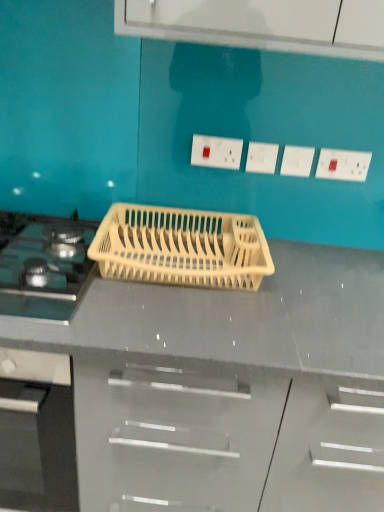
What do you see at coordinates (181, 247) in the screenshot? I see `beige plastic dish rack at center` at bounding box center [181, 247].

Where is `white plastic electric outlet at upper right, which appears as the 1th electric outlet when viewed from the right`? The width and height of the screenshot is (384, 512). white plastic electric outlet at upper right, which appears as the 1th electric outlet when viewed from the right is located at coordinates (343, 165).

This screenshot has width=384, height=512. Describe the element at coordinates (216, 152) in the screenshot. I see `white plastic electric outlet at center, the first electric outlet from the left` at that location.

In order to face white plastic electric outlet at upper center, which is the second electric outlet from left to right, should I rotate leftwards or rightwards?

Turn right by 9.595 degrees to look at white plastic electric outlet at upper center, which is the second electric outlet from left to right.

Identify the location of beige plastic dish rack at center. The image size is (384, 512). (181, 247).

Could you tell me if matte black gas stove at left is facing white plastic electric outlet at upper right, positioned as the 4th electric outlet in left-to-right order?

No, matte black gas stove at left is not facing towards white plastic electric outlet at upper right, positioned as the 4th electric outlet in left-to-right order.

Does matte black gas stove at left have a lesser height compared to white plastic electric outlet at upper right, which appears as the 1th electric outlet when viewed from the right?

Indeed, matte black gas stove at left has a lesser height compared to white plastic electric outlet at upper right, which appears as the 1th electric outlet when viewed from the right.

From a real-world perspective, is matte black gas stove at left under white plastic electric outlet at upper right, positioned as the 4th electric outlet in left-to-right order?

Yes, from a real-world perspective, matte black gas stove at left is below white plastic electric outlet at upper right, positioned as the 4th electric outlet in left-to-right order.

I want to click on gas stove below the white plastic electric outlet at upper right, which appears as the 1th electric outlet when viewed from the right (from the image's perspective), so click(46, 268).

Could you tell me if white plastic electric outlet at upper center, the third electric outlet viewed from the right, is turned towards white plastic electric outlet at upper center, the third electric outlet from the left?

No, white plastic electric outlet at upper center, the third electric outlet viewed from the right, does not turn towards white plastic electric outlet at upper center, the third electric outlet from the left.

Between point (272, 148) and point (303, 153), which one is positioned behind?

The point (303, 153) is more distant.

Which object is wider, white plastic electric outlet at upper center, the third electric outlet viewed from the right, or white plastic electric outlet at upper center, the second electric outlet from the right?

With larger width is white plastic electric outlet at upper center, the third electric outlet viewed from the right.

In terms of size, does white plastic electric outlet at upper center, the third electric outlet viewed from the right, appear bigger or smaller than white plastic electric outlet at upper center, the third electric outlet from the left?

In the image, white plastic electric outlet at upper center, the third electric outlet viewed from the right, appears to be larger than white plastic electric outlet at upper center, the third electric outlet from the left.

In terms of size, does white plastic electric outlet at upper right, which appears as the 1th electric outlet when viewed from the right, appear bigger or smaller than matte black gas stove at left?

white plastic electric outlet at upper right, which appears as the 1th electric outlet when viewed from the right, is smaller than matte black gas stove at left.

From a real-world perspective, who is located lower, white plastic electric outlet at upper right, positioned as the 4th electric outlet in left-to-right order, or matte black gas stove at left?

matte black gas stove at left, from a real-world perspective.

Between white plastic electric outlet at upper right, which appears as the 1th electric outlet when viewed from the right, and matte black gas stove at left, which one appears on the left side from the viewer's perspective?

From the viewer's perspective, matte black gas stove at left appears more on the left side.

In the scene shown: Considering the sizes of objects white plastic electric outlet at upper right, positioned as the 4th electric outlet in left-to-right order, and matte black gas stove at left in the image provided, who is shorter, white plastic electric outlet at upper right, positioned as the 4th electric outlet in left-to-right order, or matte black gas stove at left?

With less height is matte black gas stove at left.

Consider the image. Which object is more forward, matte black gas stove at left or beige plastic dish rack at center?

matte black gas stove at left.

Between matte black gas stove at left and beige plastic dish rack at center, which one has smaller width?

beige plastic dish rack at center is thinner.

Are matte black gas stove at left and beige plastic dish rack at center located far from each other?

No, matte black gas stove at left is in close proximity to beige plastic dish rack at center.

From a real-world perspective, which object stands above the other?

In real-world perspective, beige plastic dish rack at center is above.

Looking at this image, from the image's perspective, is matte black gas stove at left under white plastic electric outlet at upper center, which is the second electric outlet from left to right?

Indeed, from the image's perspective, matte black gas stove at left is shown beneath white plastic electric outlet at upper center, which is the second electric outlet from left to right.

From a real-world perspective, which is physically below, matte black gas stove at left or white plastic electric outlet at upper center, the third electric outlet viewed from the right?

matte black gas stove at left.

Considering the sizes of objects beige plastic dish rack at center and white plastic electric outlet at upper center, the second electric outlet from the right, in the image provided, who is smaller, beige plastic dish rack at center or white plastic electric outlet at upper center, the second electric outlet from the right,?

white plastic electric outlet at upper center, the second electric outlet from the right.

From the image's perspective, does beige plastic dish rack at center appear higher than white plastic electric outlet at upper center, the third electric outlet from the left?

No.

How different are the orientations of beige plastic dish rack at center and white plastic electric outlet at upper center, the second electric outlet from the right, in degrees?

The facing directions of beige plastic dish rack at center and white plastic electric outlet at upper center, the second electric outlet from the right, are 1.1 degrees apart.

Visually, is beige plastic dish rack at center positioned to the left or to the right of white plastic electric outlet at upper center, the third electric outlet from the left?

Based on their positions, beige plastic dish rack at center is located to the left of white plastic electric outlet at upper center, the third electric outlet from the left.

Which is closer to the camera, (x=286, y=161) or (x=270, y=160)?

Point (x=286, y=161) is closer to the camera than point (x=270, y=160).

From a real-world perspective, is white plastic electric outlet at upper center, the second electric outlet from the right, beneath white plastic electric outlet at upper center, the third electric outlet viewed from the right?

Yes, from a real-world perspective, white plastic electric outlet at upper center, the second electric outlet from the right, is below white plastic electric outlet at upper center, the third electric outlet viewed from the right.

Based on the photo, which of these two, white plastic electric outlet at upper center, the second electric outlet from the right, or white plastic electric outlet at upper center, the third electric outlet viewed from the right, is thinner?

With smaller width is white plastic electric outlet at upper center, the second electric outlet from the right.

From the image's perspective, is white plastic electric outlet at upper center, the third electric outlet from the left, located above or below white plastic electric outlet at upper center, which is the second electric outlet from left to right?

Based on their image positions, white plastic electric outlet at upper center, the third electric outlet from the left, is located beneath white plastic electric outlet at upper center, which is the second electric outlet from left to right.

Identify the location of the 3rd electric outlet above the matte black gas stove at left (from a real-world perspective). This screenshot has width=384, height=512. (343, 165).

Which electric outlet is the 1st one when counting from the right side of the white plastic electric outlet at upper center, which is the second electric outlet from left to right? Please provide its 2D coordinates.

[(297, 161)]

From the image, which object appears to be nearer to white plastic electric outlet at upper center, the third electric outlet from the left, white plastic electric outlet at upper right, which appears as the 1th electric outlet when viewed from the right, or white plastic electric outlet at center, the first electric outlet from the left?

white plastic electric outlet at upper right, which appears as the 1th electric outlet when viewed from the right, lies closer to white plastic electric outlet at upper center, the third electric outlet from the left, than the other object.

Which object lies further to the anchor point white plastic electric outlet at center, the first electric outlet from the left, white plastic electric outlet at upper right, positioned as the 4th electric outlet in left-to-right order, or white plastic electric outlet at upper center, which is the second electric outlet from left to right?

Among the two, white plastic electric outlet at upper right, positioned as the 4th electric outlet in left-to-right order, is located further to white plastic electric outlet at center, the first electric outlet from the left.

When comparing their distances from matte black gas stove at left, does white plastic electric outlet at center, arranged as the fourth electric outlet when viewed from the right, or beige plastic dish rack at center seem further?

Based on the image, white plastic electric outlet at center, arranged as the fourth electric outlet when viewed from the right, appears to be further to matte black gas stove at left.

Based on their spatial positions, is matte black gas stove at left or white plastic electric outlet at upper center, the second electric outlet from the right, closer to white plastic electric outlet at upper center, the third electric outlet viewed from the right?

white plastic electric outlet at upper center, the second electric outlet from the right, is positioned closer to the anchor white plastic electric outlet at upper center, the third electric outlet viewed from the right.

Looking at the image, which one is located further to white plastic electric outlet at center, arranged as the fourth electric outlet when viewed from the right, white plastic electric outlet at upper center, the second electric outlet from the right, or white plastic electric outlet at upper right, positioned as the 4th electric outlet in left-to-right order?

The object further to white plastic electric outlet at center, arranged as the fourth electric outlet when viewed from the right, is white plastic electric outlet at upper right, positioned as the 4th electric outlet in left-to-right order.

Which object lies nearer to the anchor point white plastic electric outlet at upper center, the second electric outlet from the right, white plastic electric outlet at center, arranged as the fourth electric outlet when viewed from the right, or white plastic electric outlet at upper right, positioned as the 4th electric outlet in left-to-right order?

white plastic electric outlet at upper right, positioned as the 4th electric outlet in left-to-right order, is closer to white plastic electric outlet at upper center, the second electric outlet from the right.

Which object lies nearer to the anchor point white plastic electric outlet at upper right, which appears as the 1th electric outlet when viewed from the right, matte black gas stove at left or white plastic electric outlet at upper center, which is the second electric outlet from left to right?

Among the two, white plastic electric outlet at upper center, which is the second electric outlet from left to right, is located nearer to white plastic electric outlet at upper right, which appears as the 1th electric outlet when viewed from the right.

From the image, which object appears to be farther from white plastic electric outlet at center, the first electric outlet from the left, white plastic electric outlet at upper right, which appears as the 1th electric outlet when viewed from the right, or white plastic electric outlet at upper center, the third electric outlet from the left?

Based on the image, white plastic electric outlet at upper right, which appears as the 1th electric outlet when viewed from the right, appears to be further to white plastic electric outlet at center, the first electric outlet from the left.

Where is `kitchen appliance between matte black gas stove at left and white plastic electric outlet at upper center, the third electric outlet viewed from the right, from left to right`? The height and width of the screenshot is (512, 384). kitchen appliance between matte black gas stove at left and white plastic electric outlet at upper center, the third electric outlet viewed from the right, from left to right is located at coordinates (181, 247).

Identify the location of kitchen appliance between matte black gas stove at left and white plastic electric outlet at upper right, positioned as the 4th electric outlet in left-to-right order, in the horizontal direction. This screenshot has height=512, width=384. (181, 247).

The image size is (384, 512). Identify the location of electric outlet situated between white plastic electric outlet at upper center, the third electric outlet viewed from the right, and white plastic electric outlet at upper right, positioned as the 4th electric outlet in left-to-right order, from left to right. (297, 161).

Locate an element on the screen. kitchen appliance between matte black gas stove at left and white plastic electric outlet at upper center, the third electric outlet from the left, from left to right is located at coordinates (181, 247).